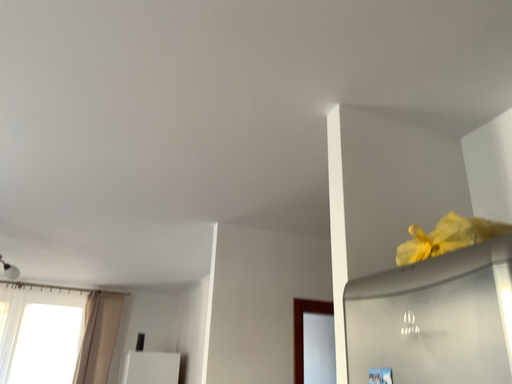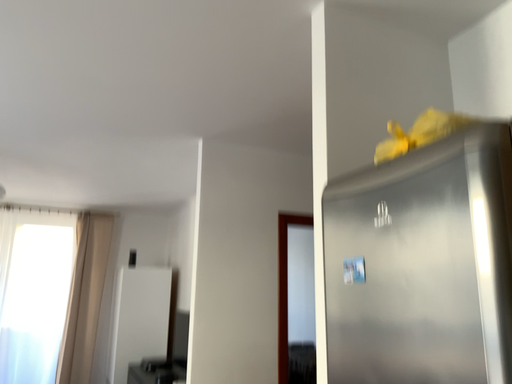
Question: Which way did the camera rotate in the video?

Choices:
 (A) rotated upward
 (B) rotated downward

Answer: (B)